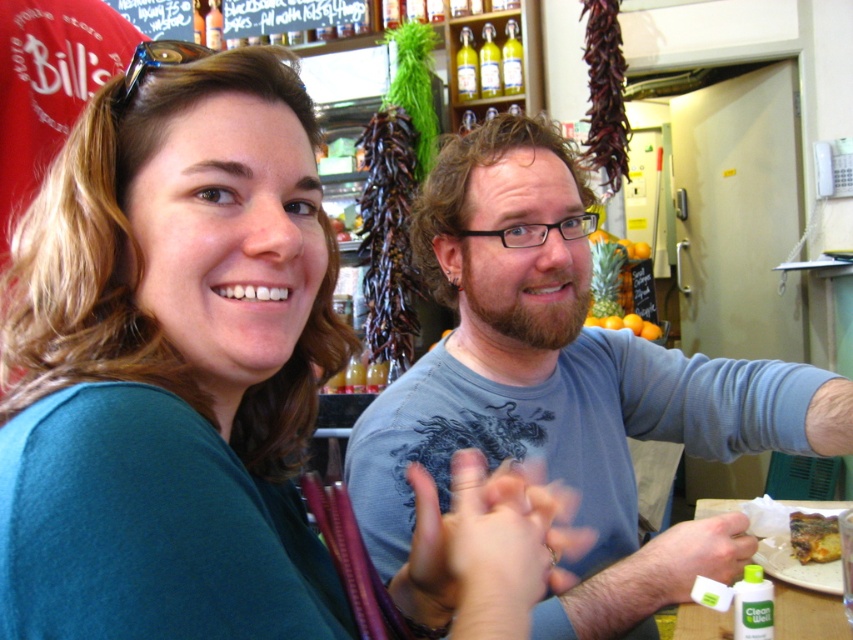
Question: Which object is closer to the camera taking this photo?

Choices:
 (A) blue cotton shirt at center
 (B) blue reflective sunglasses at upper left
 (C) white paper plate at lower right
 (D) teal fabric shirt at upper left

Answer: (D)

Question: Is golden crispy pastry at center smaller than blue reflective sunglasses at upper left?

Choices:
 (A) yes
 (B) no

Answer: (A)

Question: Can you confirm if blue cotton shirt at center is smaller than white paper plate at lower right?

Choices:
 (A) yes
 (B) no

Answer: (B)

Question: Which of these objects is positioned farthest from the blue cotton shirt at center?

Choices:
 (A) green matte bottle at lower right
 (B) golden crispy pastry at center
 (C) teal fabric shirt at upper left
 (D) white paper plate at lower right

Answer: (B)

Question: Which is farther from the green matte bottle at lower right?

Choices:
 (A) blue reflective sunglasses at upper left
 (B) white paper plate at lower right
 (C) blue cotton shirt at center
 (D) golden crispy pastry at center

Answer: (A)

Question: Does blue cotton shirt at center have a smaller size compared to green matte bottle at lower right?

Choices:
 (A) yes
 (B) no

Answer: (B)